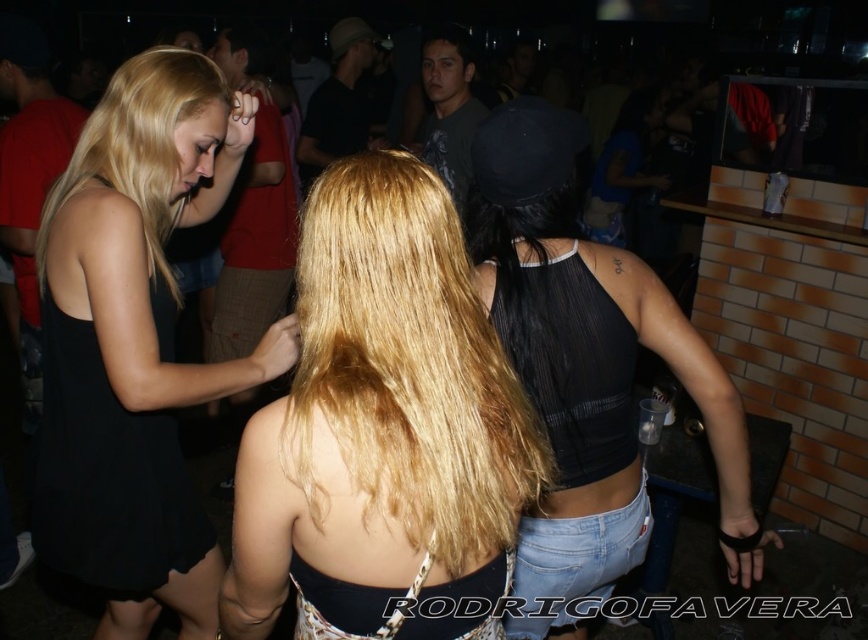
Question: Which object appears farthest from the camera in this image?

Choices:
 (A) blonde silky hair at upper left
 (B) blonde hair at center
 (C) black mesh tank top at center

Answer: (A)

Question: Which object is the farthest from the blonde hair at center?

Choices:
 (A) blonde silky hair at upper left
 (B) black sleeveless dress at left

Answer: (A)

Question: Is black mesh tank top at center closer to the viewer compared to blonde silky hair at upper left?

Choices:
 (A) no
 (B) yes

Answer: (B)

Question: Which point is farther from the camera taking this photo?

Choices:
 (A) (409, 522)
 (B) (580, 385)
 (C) (43, 227)

Answer: (C)

Question: Can you confirm if blonde hair at center is wider than black sleeveless dress at left?

Choices:
 (A) yes
 (B) no

Answer: (B)

Question: Is black sleeveless dress at left below blonde silky hair at upper left?

Choices:
 (A) no
 (B) yes

Answer: (B)